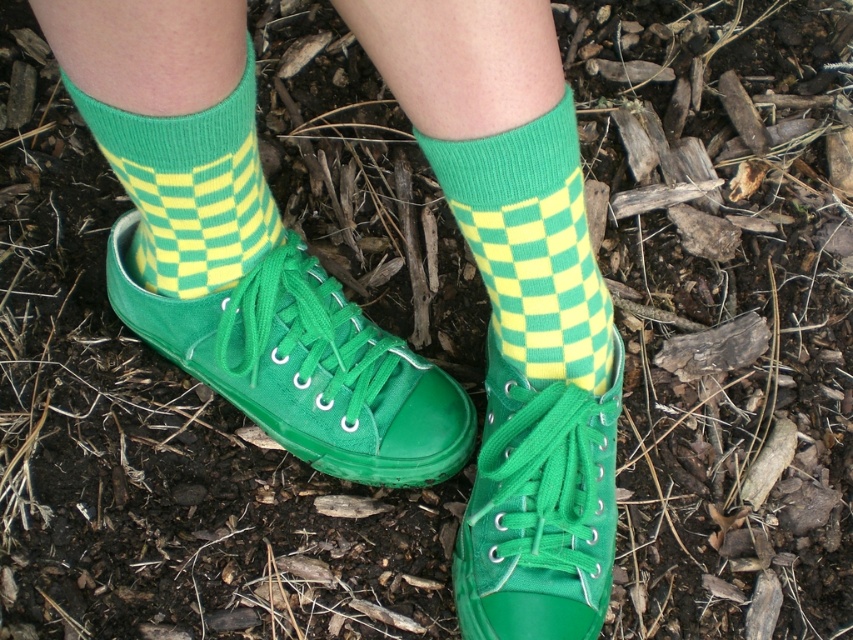
Question: Among these objects, which one is nearest to the camera?

Choices:
 (A) green canvas shoe at center
 (B) green rubber shoe at center
 (C) green checkered sock at center
 (D) green canvas shoes at center

Answer: (D)

Question: Which point is farther to the camera?

Choices:
 (A) green canvas shoe at center
 (B) green checkered sock at center
 (C) green knitted sock at center

Answer: (A)

Question: Can you confirm if green rubber shoe at center is positioned to the right of green knitted sock at center?

Choices:
 (A) no
 (B) yes

Answer: (B)

Question: Which is farther from the green knitted sock at center?

Choices:
 (A) green rubber shoe at center
 (B) green checkered sock at center
 (C) green canvas shoes at center
 (D) green canvas shoe at center

Answer: (D)

Question: Does green canvas shoes at center have a lesser width compared to green knitted sock at center?

Choices:
 (A) yes
 (B) no

Answer: (B)

Question: Is green checkered sock at center in front of green knitted sock at center?

Choices:
 (A) yes
 (B) no

Answer: (B)